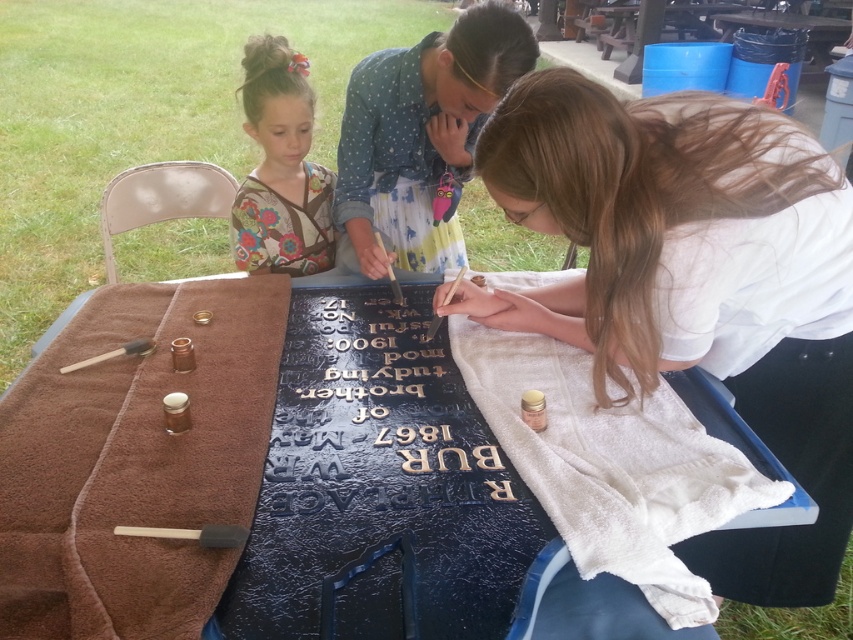
You are organizing a craft event and need to arrange participants based on their shirt colors. If you see the matte white shirt at center and the floral fabric shirt at upper left, which shirt should you direct to the front of the line?

The matte white shirt at center should be directed to the front of the line since it is closer to the viewer than the floral fabric shirt at upper left.

Looking at this image, you are an artist standing in front of the table where the matte white shirt at center and the gold embossed letters at center are placed. You want to touch both items without moving your position. Which item would you reach first?

The matte white shirt at center is closer to you than the gold embossed letters at center, so you would reach the matte white shirt at center first.

From the picture: You are standing at the edge of the grassy area and want to place a small decorative item exactly at the point marked as point [363,492]. According to the scene, where should you place it?

The point [363,492] is on the blue textured tablecloth at center, so you should place the item on the blue textured tablecloth at center.